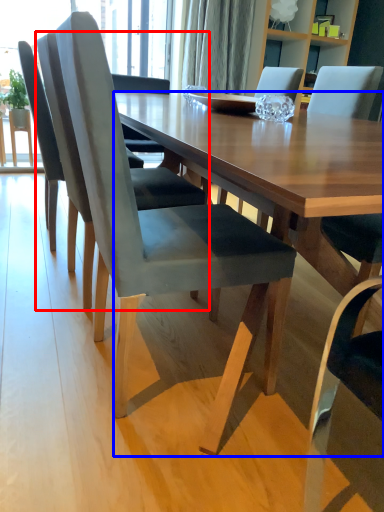
Question: Among these objects, which one is farthest to the camera, chair (highlighted by a red box) or desk (highlighted by a blue box)?

Choices:
 (A) chair
 (B) desk

Answer: (A)